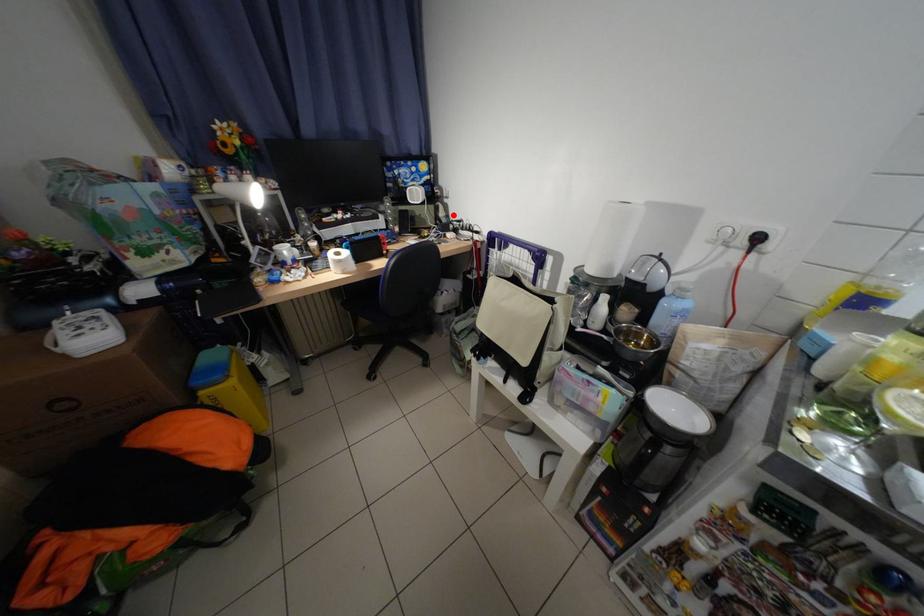
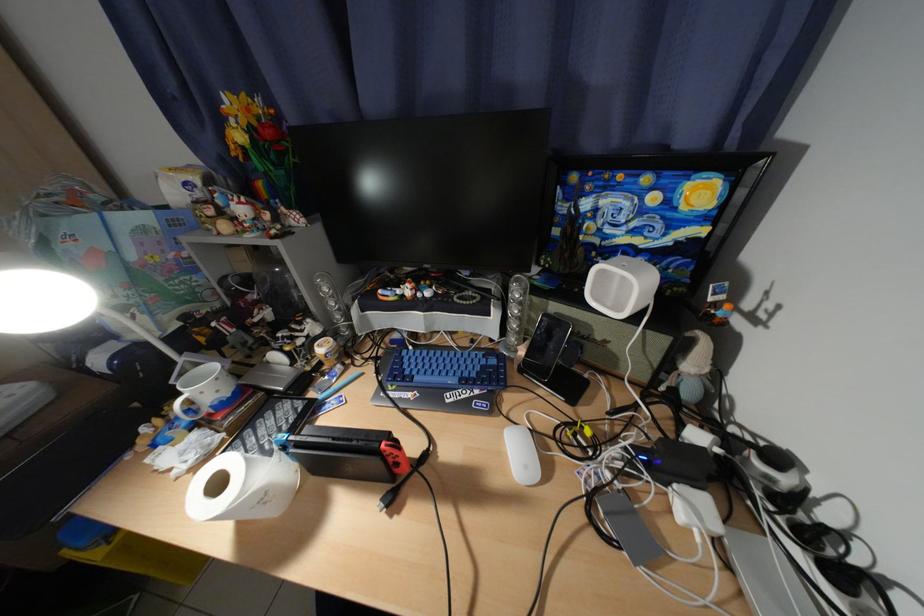
In the second image, find the point that corresponds to the highlighted location in the first image.

(704, 367)